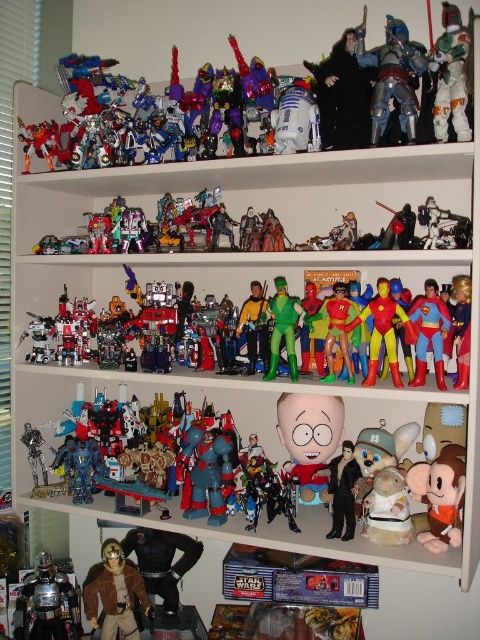
Question: Can you confirm if shiny silver armor at lower left is positioned to the right of shiny metallic robots at center?

Choices:
 (A) no
 (B) yes

Answer: (A)

Question: Does metallic blue robot at center have a greater width compared to white plastic boba fett at upper center?

Choices:
 (A) no
 (B) yes

Answer: (B)

Question: Which is farther from the shiny silver armor at lower left?

Choices:
 (A) shiny metallic robot at center
 (B) multicolored plastic action figure at center
 (C) metallic silver armor at upper right

Answer: (C)

Question: Which point appears farthest from the camera in this image?

Choices:
 (A) (29, 596)
 (B) (442, 308)
 (C) (260, 541)
 (D) (332, 324)

Answer: (A)

Question: Can you confirm if shiny metallic robot at center is thinner than metallic blue robot at center?

Choices:
 (A) yes
 (B) no

Answer: (B)

Question: Which is farther from the brown fabric jacket at lower left?

Choices:
 (A) multicolored plastic action figure at center
 (B) shiny metallic robot at center

Answer: (A)